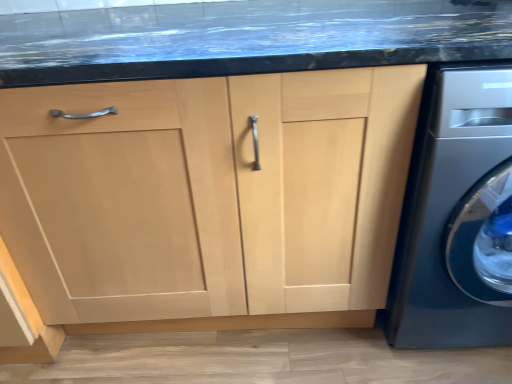
The image size is (512, 384). What do you see at coordinates (208, 193) in the screenshot? I see `natural wood cabinet at center` at bounding box center [208, 193].

Identify the location of natural wood cabinet at center. The width and height of the screenshot is (512, 384). (208, 193).

Measure the distance between satin silver washing machine at lower right and camera.

satin silver washing machine at lower right and camera are 32.50 inches apart from each other.

Identify the location of satin silver washing machine at lower right. The height and width of the screenshot is (384, 512). (457, 216).

What do you see at coordinates (457, 216) in the screenshot? I see `satin silver washing machine at lower right` at bounding box center [457, 216].

Find the location of `natural wood cabinet at center`. natural wood cabinet at center is located at coordinates [x=208, y=193].

Considering the positions of objects natural wood cabinet at center and satin silver washing machine at lower right in the image provided, who is more to the right, natural wood cabinet at center or satin silver washing machine at lower right?

satin silver washing machine at lower right.

Is natural wood cabinet at center in front of satin silver washing machine at lower right?

No, natural wood cabinet at center is further to the viewer.

Which is in front, point (303, 107) or point (459, 176)?

The point (303, 107) is closer to the camera.

From the image's perspective, is natural wood cabinet at center positioned above or below satin silver washing machine at lower right?

natural wood cabinet at center is situated lower than satin silver washing machine at lower right in the image.

From a real-world perspective, does natural wood cabinet at center sit lower than satin silver washing machine at lower right?

Yes.

Between natural wood cabinet at center and satin silver washing machine at lower right, which one has larger width?

satin silver washing machine at lower right is wider.

Considering the relative sizes of natural wood cabinet at center and satin silver washing machine at lower right in the image provided, is natural wood cabinet at center shorter than satin silver washing machine at lower right?

Indeed, natural wood cabinet at center has a lesser height compared to satin silver washing machine at lower right.

Considering the sizes of natural wood cabinet at center and satin silver washing machine at lower right in the image, is natural wood cabinet at center bigger or smaller than satin silver washing machine at lower right?

In the image, natural wood cabinet at center appears to be larger than satin silver washing machine at lower right.

Does natural wood cabinet at center contain satin silver washing machine at lower right?

Actually, satin silver washing machine at lower right is outside natural wood cabinet at center.

Based on the photo, are natural wood cabinet at center and satin silver washing machine at lower right far apart?

They are positioned close to each other.

Could you tell me if natural wood cabinet at center is facing satin silver washing machine at lower right?

No, natural wood cabinet at center is not facing towards satin silver washing machine at lower right.

Can you tell me how much natural wood cabinet at center and satin silver washing machine at lower right differ in facing direction?

5.24e-05 degrees separate the facing orientations of natural wood cabinet at center and satin silver washing machine at lower right.

The width and height of the screenshot is (512, 384). I want to click on cabinetry that appears behind the satin silver washing machine at lower right, so click(x=208, y=193).

Is satin silver washing machine at lower right to the left or to the right of natural wood cabinet at center in the image?

From the image, it's evident that satin silver washing machine at lower right is to the right of natural wood cabinet at center.

Which is in front, satin silver washing machine at lower right or natural wood cabinet at center?

satin silver washing machine at lower right is more forward.

Does point (490, 280) come in front of point (102, 264)?

No, it is not.

From the image's perspective, between satin silver washing machine at lower right and natural wood cabinet at center, who is located below?

natural wood cabinet at center.

From a real-world perspective, is satin silver washing machine at lower right positioned above or below natural wood cabinet at center?

Clearly, from a real-world perspective, satin silver washing machine at lower right is above natural wood cabinet at center.

Considering the sizes of objects satin silver washing machine at lower right and natural wood cabinet at center in the image provided, who is thinner, satin silver washing machine at lower right or natural wood cabinet at center?

Thinner between the two is natural wood cabinet at center.

From the picture: Considering the sizes of objects satin silver washing machine at lower right and natural wood cabinet at center in the image provided, who is shorter, satin silver washing machine at lower right or natural wood cabinet at center?

With less height is natural wood cabinet at center.

Can you confirm if satin silver washing machine at lower right is bigger than natural wood cabinet at center?

Actually, satin silver washing machine at lower right might be smaller than natural wood cabinet at center.

Choose the correct answer: Is satin silver washing machine at lower right inside natural wood cabinet at center or outside it?

satin silver washing machine at lower right is outside natural wood cabinet at center.

Is the surface of satin silver washing machine at lower right in direct contact with natural wood cabinet at center?

No, satin silver washing machine at lower right is not beside natural wood cabinet at center.

Could you tell me if satin silver washing machine at lower right is turned towards natural wood cabinet at center?

No, satin silver washing machine at lower right is not turned towards natural wood cabinet at center.

What's the angular difference between satin silver washing machine at lower right and natural wood cabinet at center's facing directions?

5.24e-05 degrees separate the facing orientations of satin silver washing machine at lower right and natural wood cabinet at center.

Where is `washing machine above the natural wood cabinet at center (from the image's perspective)`? The width and height of the screenshot is (512, 384). washing machine above the natural wood cabinet at center (from the image's perspective) is located at coordinates (457, 216).

The height and width of the screenshot is (384, 512). Find the location of `washing machine in front of the natural wood cabinet at center`. washing machine in front of the natural wood cabinet at center is located at coordinates (457, 216).

In the image, there is a natural wood cabinet at center. Where is `washing machine above it (from the image's perspective)`? Image resolution: width=512 pixels, height=384 pixels. washing machine above it (from the image's perspective) is located at coordinates (457, 216).